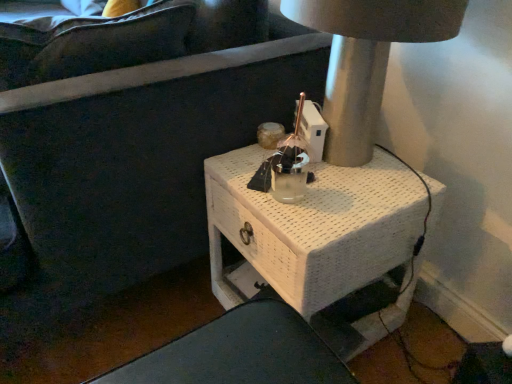
This screenshot has height=384, width=512. What are the coordinates of `vacant location below matte gray table lamp at upper right (from a real-world perspective)` in the screenshot? It's located at (357, 171).